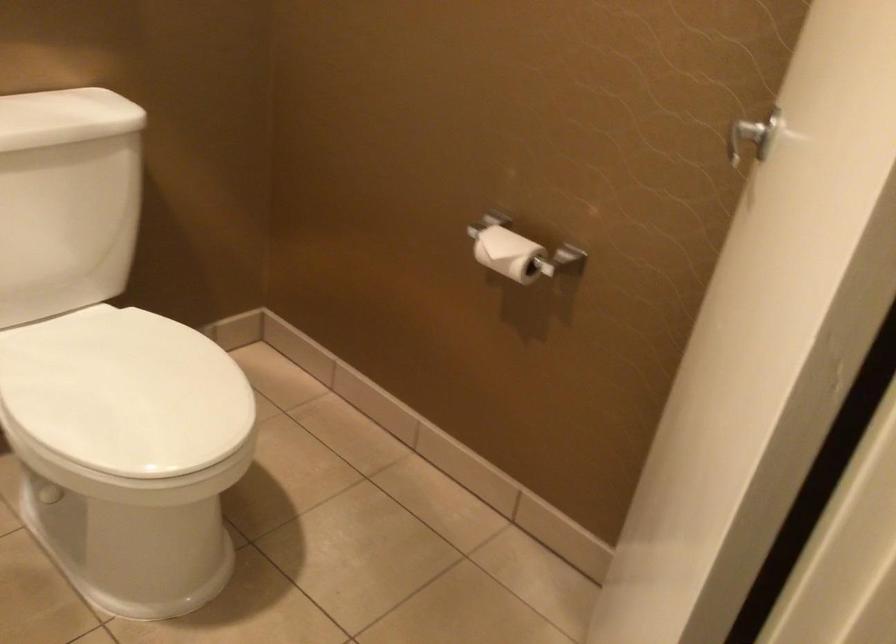
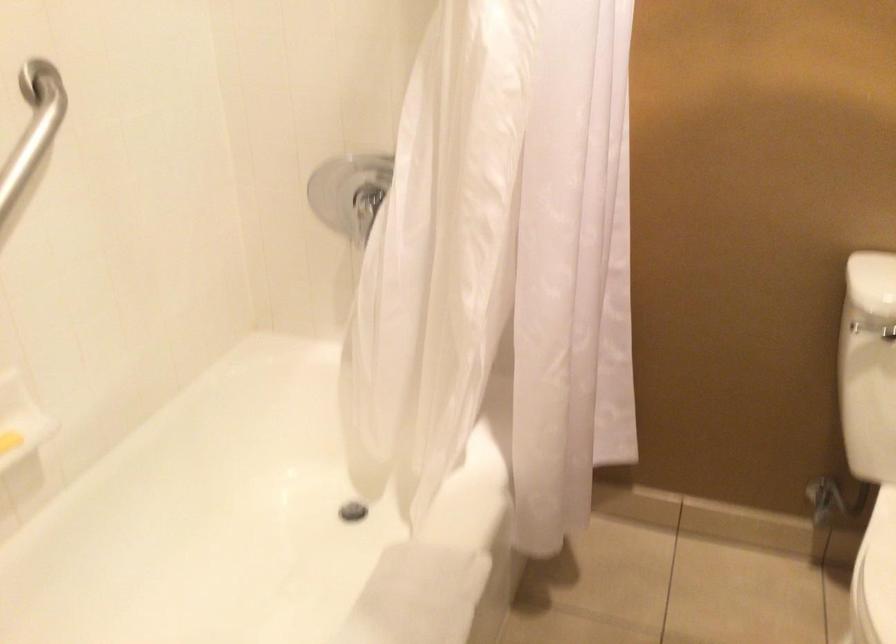
Question: The camera is either moving clockwise (left) or counter-clockwise (right) around the object. The first image is from the beginning of the video and the second image is from the end. Is the camera moving left or right when shooting the video?

Choices:
 (A) Left
 (B) Right

Answer: (B)